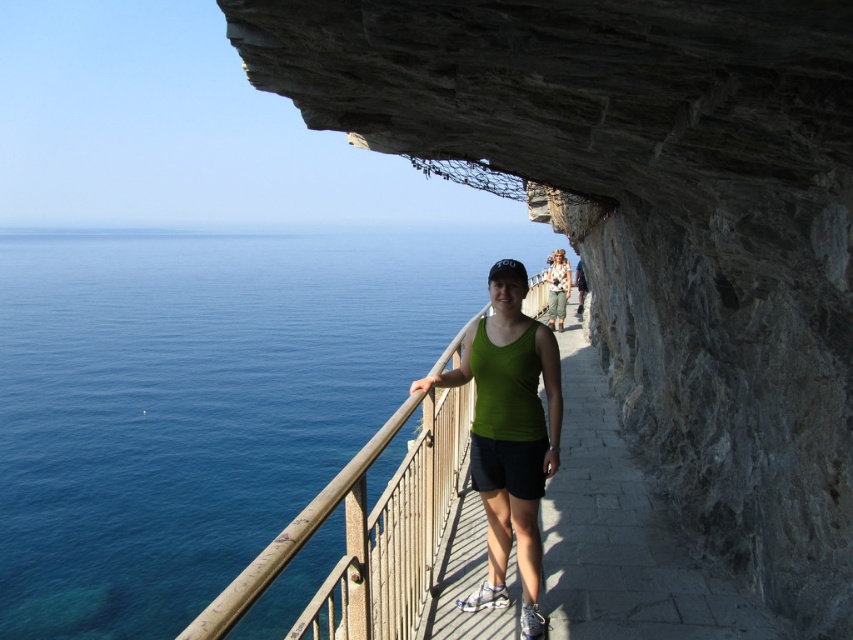
Can you confirm if gray stone cliff at upper center is smaller than floral fabric shirt at center?

Actually, gray stone cliff at upper center might be larger than floral fabric shirt at center.

Does point (786, 48) come behind point (549, 273)?

No, (786, 48) is closer to viewer.

Who is more distant from viewer, (780, 321) or (563, 291)?

Positioned behind is point (563, 291).

What are the coordinates of `gray stone cliff at upper center` in the screenshot? It's located at (651, 221).

Does gray stone cliff at upper center have a lesser width compared to blue liquid water at left?

Indeed, gray stone cliff at upper center has a lesser width compared to blue liquid water at left.

Between gray stone cliff at upper center and blue liquid water at left, which one appears on the left side from the viewer's perspective?

blue liquid water at left is more to the left.

Between point (718, 120) and point (334, 442), which one is positioned in front?

Point (718, 120)

The image size is (853, 640). I want to click on gray stone cliff at upper center, so click(x=651, y=221).

Between green fabric tank top at center and floral fabric shirt at center, which one appears on the right side from the viewer's perspective?

From the viewer's perspective, floral fabric shirt at center appears more on the right side.

Is green fabric tank top at center bigger than floral fabric shirt at center?

Indeed, green fabric tank top at center has a larger size compared to floral fabric shirt at center.

Which is in front, point (485, 456) or point (553, 273)?

Point (485, 456) is in front.

Identify the location of green fabric tank top at center. (509, 436).